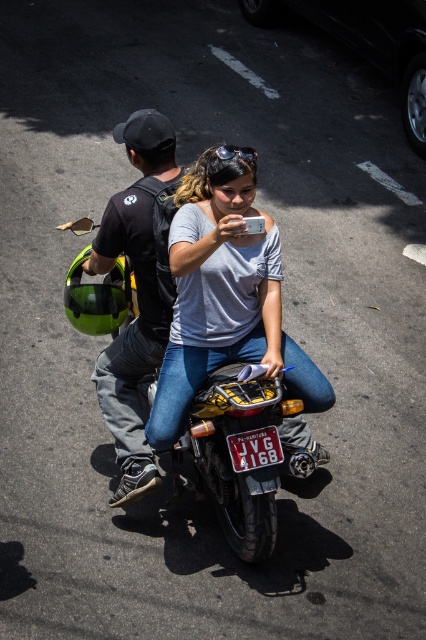
Which is below, metallic yellow motorcycle at center or black matte helmet at left?

metallic yellow motorcycle at center

Does metallic yellow motorcycle at center have a greater height compared to black matte helmet at left?

No, metallic yellow motorcycle at center is not taller than black matte helmet at left.

Where is `metallic yellow motorcycle at center`? This screenshot has height=640, width=426. metallic yellow motorcycle at center is located at coordinates (236, 456).

Which of these two, matte gray shirt at center or metallic yellow motorcycle at center, stands taller?

With more height is matte gray shirt at center.

Is matte gray shirt at center above metallic yellow motorcycle at center?

Yes, matte gray shirt at center is above metallic yellow motorcycle at center.

Where is `matte gray shirt at center`? This screenshot has height=640, width=426. matte gray shirt at center is located at coordinates (x=224, y=296).

Where is `matte gray shirt at center`? matte gray shirt at center is located at coordinates (224, 296).

Does matte gray shirt at center have a larger size compared to black matte helmet at left?

Indeed, matte gray shirt at center has a larger size compared to black matte helmet at left.

Which of these two, matte gray shirt at center or black matte helmet at left, stands shorter?

matte gray shirt at center

Does point (219, 340) come farther from viewer compared to point (150, 353)?

No, it is in front of (150, 353).

Where is `matte gray shirt at center`? The height and width of the screenshot is (640, 426). matte gray shirt at center is located at coordinates (224, 296).